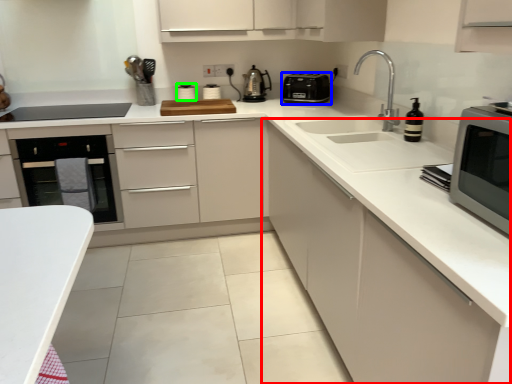
Question: Which object is the closest to the cabinetry (highlighted by a red box)? Choose among these: kitchen appliance (highlighted by a blue box) or appliance (highlighted by a green box).

Choices:
 (A) kitchen appliance
 (B) appliance

Answer: (A)